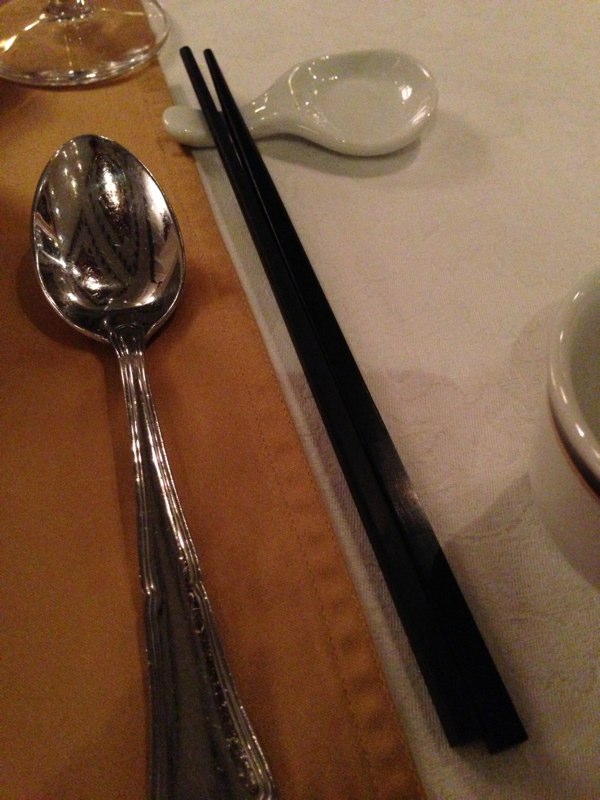
Where is `chopstick rest`? The width and height of the screenshot is (600, 800). chopstick rest is located at coordinates (302, 106).